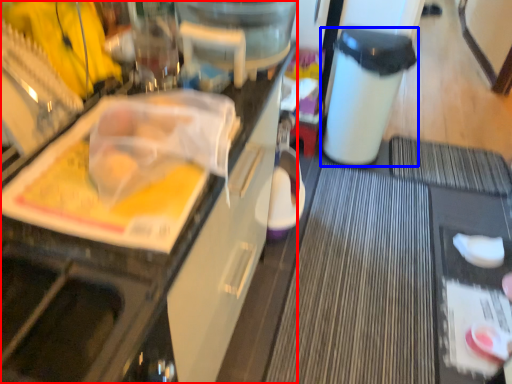
Question: Which point is further to the camera, cabinetry (highlighted by a red box) or trash bin/can (highlighted by a blue box)?

Choices:
 (A) cabinetry
 (B) trash bin/can

Answer: (B)